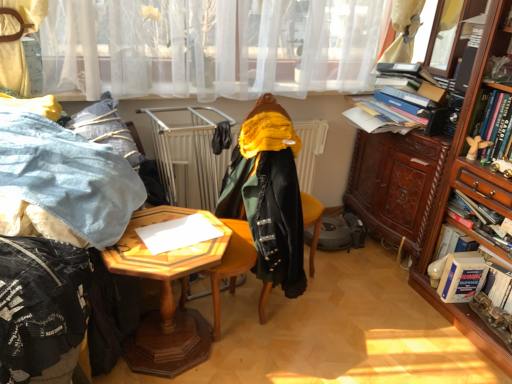
Question: Considering the relative sizes of hardcover book at right, acting as the 2th book starting from the top, and velvet black coat at center in the image provided, is hardcover book at right, acting as the 2th book starting from the top, shorter than velvet black coat at center?

Choices:
 (A) no
 (B) yes

Answer: (B)

Question: From the image's perspective, does hardcover book at right, acting as the 2th book starting from the top, appear lower than velvet black coat at center?

Choices:
 (A) no
 (B) yes

Answer: (A)

Question: From a real-world perspective, is hardcover book at right, acting as the 2th book starting from the top, physically below velvet black coat at center?

Choices:
 (A) yes
 (B) no

Answer: (B)

Question: Does hardcover book at right, acting as the 2th book starting from the top, appear on the right side of velvet black coat at center?

Choices:
 (A) yes
 (B) no

Answer: (A)

Question: Is hardcover book at right, the 3th book from the bottom, looking in the opposite direction of velvet black coat at center?

Choices:
 (A) yes
 (B) no

Answer: (B)

Question: Is the position of hardcover book at right, the 3th book from the bottom, less distant than that of velvet black coat at center?

Choices:
 (A) no
 (B) yes

Answer: (A)

Question: From the image's perspective, is wooden hexagonal table at center on top of wooden cabinet at right, acting as the 1th cabinetry starting from the front?

Choices:
 (A) yes
 (B) no

Answer: (B)

Question: Is wooden hexagonal table at center smaller than wooden cabinet at right, acting as the 1th cabinetry starting from the front?

Choices:
 (A) yes
 (B) no

Answer: (A)

Question: Is wooden hexagonal table at center to the right of wooden cabinet at right, acting as the 1th cabinetry starting from the front, from the viewer's perspective?

Choices:
 (A) no
 (B) yes

Answer: (A)

Question: Is wooden hexagonal table at center touching wooden cabinet at right, acting as the 1th cabinetry starting from the front?

Choices:
 (A) no
 (B) yes

Answer: (A)

Question: Is wooden hexagonal table at center bigger than wooden cabinet at right, marked as the second cabinetry in a back-to-front arrangement?

Choices:
 (A) no
 (B) yes

Answer: (A)

Question: Is wooden hexagonal table at center closer to camera compared to wooden cabinet at right, marked as the second cabinetry in a back-to-front arrangement?

Choices:
 (A) yes
 (B) no

Answer: (B)

Question: Can you confirm if wooden cabinet at right, marked as the second cabinetry in a back-to-front arrangement, is positioned to the left of hardcover book at right, the 1th book from the top?

Choices:
 (A) no
 (B) yes

Answer: (B)